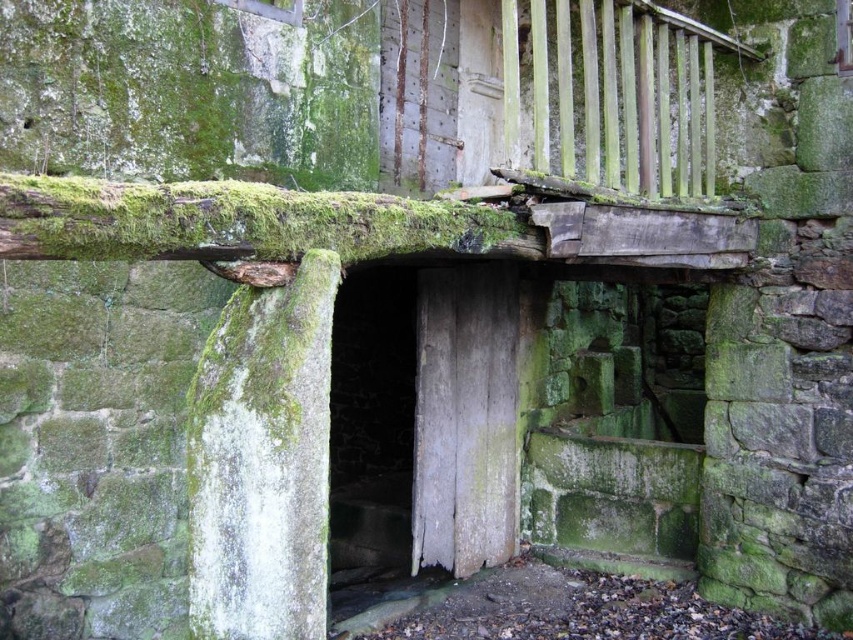
You are a painter who needs to choose between two items to paint. You have a limited amount of green paint. The green wooden rail at upper right and the green mossy log at upper center are both in your view. Which item requires more green paint to cover its surface?

The green wooden rail at upper right might be wider than the green mossy log at upper center, so it likely requires more green paint to cover its surface.

You are a maintenance worker standing at the entrance of the old stone structure. You notice a green mossy log at upper center that needs inspection. Can you reach it without moving closer than 5 feet?

The distance between the green mossy log at upper center and the viewer is 5.35 feet, so yes, you can reach it without moving closer than 5 feet since 5.35 feet is just slightly beyond the 5 feet threshold.